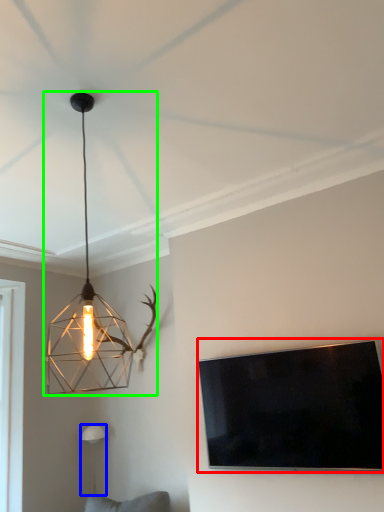
Question: Which object is the closest to the television (highlighted by a red box)? Choose among these: lamp (highlighted by a blue box) or lamp (highlighted by a green box).

Choices:
 (A) lamp
 (B) lamp

Answer: (B)